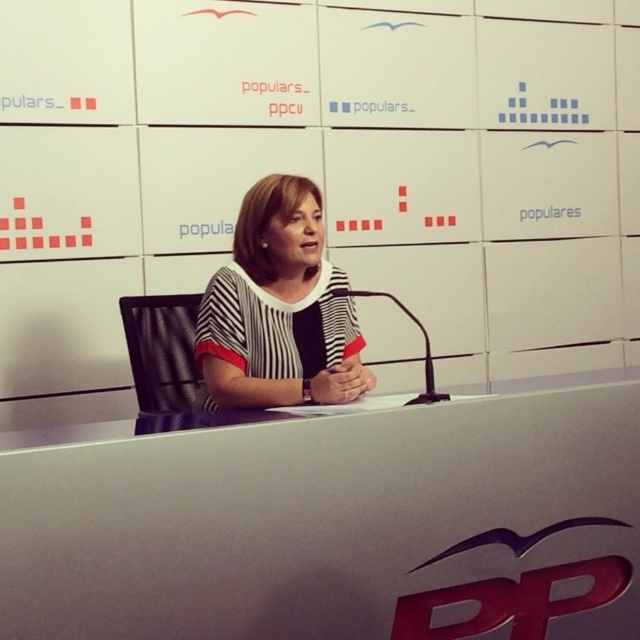
Question: Is white glossy table at center positioned at the back of striped fabric at center?

Choices:
 (A) yes
 (B) no

Answer: (B)

Question: In this image, where is white glossy table at center located relative to striped fabric at center?

Choices:
 (A) below
 (B) above

Answer: (A)

Question: Can you confirm if white glossy table at center is positioned to the right of striped fabric at center?

Choices:
 (A) yes
 (B) no

Answer: (A)